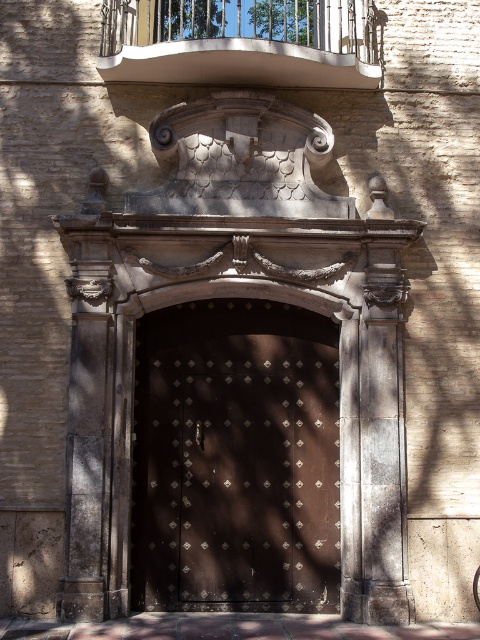
Question: Which point is farther to the camera?

Choices:
 (A) (265, 337)
 (B) (282, 10)

Answer: (B)

Question: Does dark brown metal door at center have a greater width compared to white metal balcony at upper center?

Choices:
 (A) yes
 (B) no

Answer: (B)

Question: Among these objects, which one is nearest to the camera?

Choices:
 (A) white metal balcony at upper center
 (B) dark brown metal door at center

Answer: (A)

Question: Among these points, which one is farthest from the camera?

Choices:
 (A) (354, 36)
 (B) (315, 328)

Answer: (B)

Question: Observing the image, what is the correct spatial positioning of dark brown metal door at center in reference to white metal balcony at upper center?

Choices:
 (A) above
 (B) below

Answer: (B)

Question: Is dark brown metal door at center to the left of white metal balcony at upper center from the viewer's perspective?

Choices:
 (A) yes
 (B) no

Answer: (B)